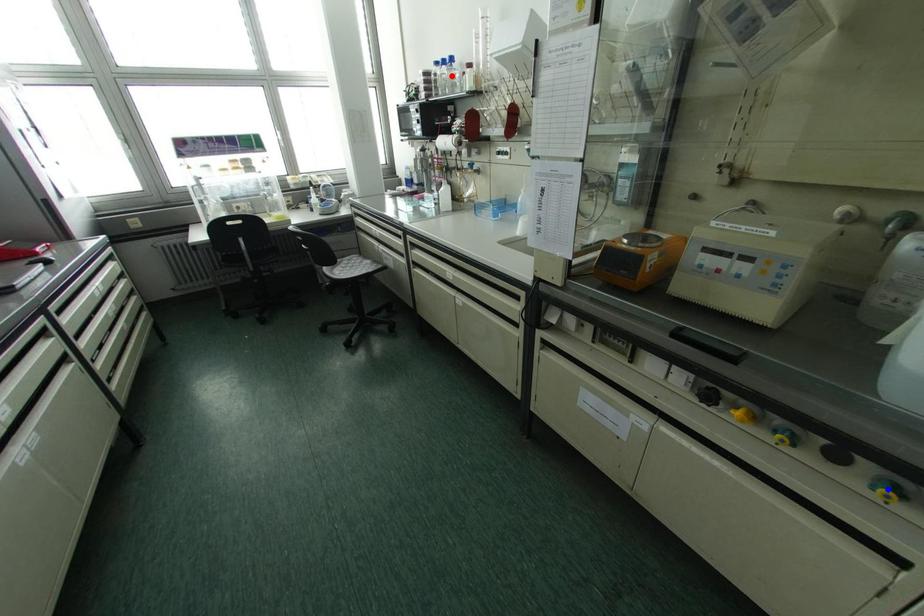
Question: In the image, two points are highlighted. Which point is nearer to the camera? Reply with the corresponding letter.

Choices:
 (A) blue point
 (B) red point

Answer: (A)